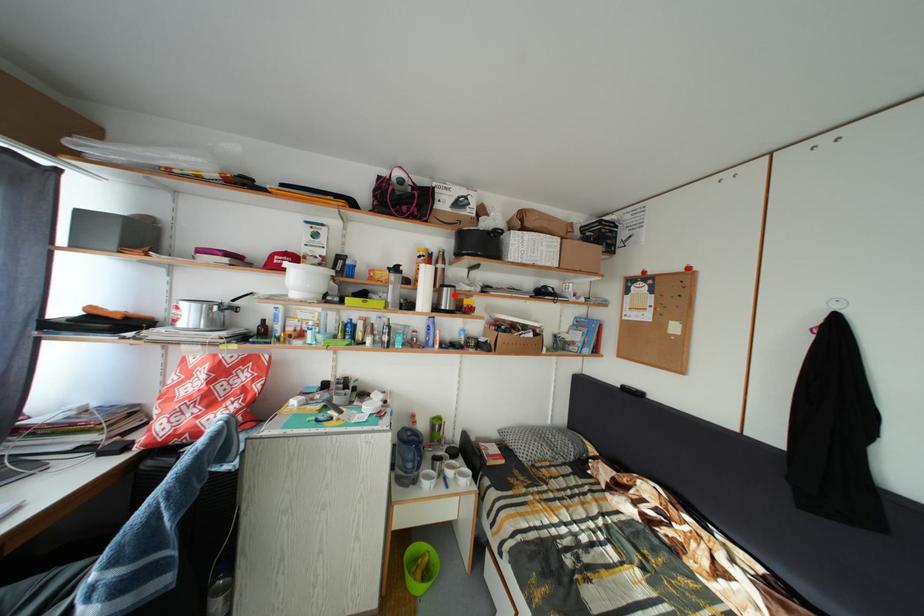
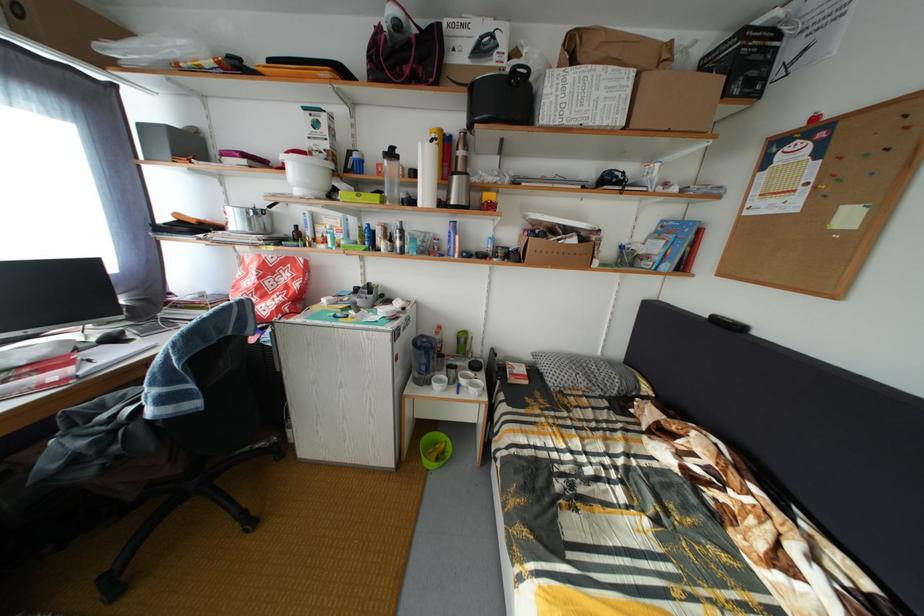
Question: I am providing you with two images of the same scene from different viewpoints. A red point is marked on the first image. At the location where the point appears in image 1, is it still visible in image 2?

Choices:
 (A) Yes
 (B) No

Answer: (A)